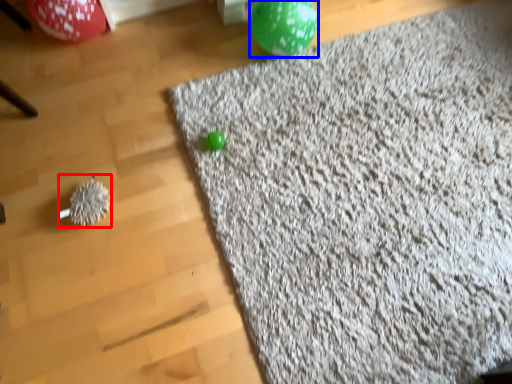
Question: Which of the following is the closest to the observer, toy (highlighted by a red box) or balloon (highlighted by a blue box)?

Choices:
 (A) toy
 (B) balloon

Answer: (A)